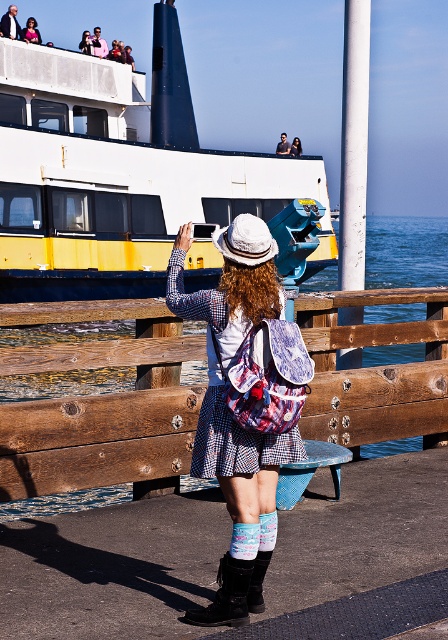
Question: Which is nearer to the leather boot at lower center?

Choices:
 (A) matte white hat at upper center
 (B) yellow painted metal ferry at upper left

Answer: (B)

Question: Which object is positioned closest to the matte black jacket at upper left?

Choices:
 (A) matte black jacket at upper center
 (B) leather boot at lower center
 (C) black leather boot at lower center

Answer: (A)

Question: Which object is the closest to the leather boot at lower center?

Choices:
 (A) pink fabric jacket at upper center
 (B) yellow painted metal ferry at upper left

Answer: (B)

Question: Observing the image, what is the correct spatial positioning of matte black jacket at upper center in reference to matte white hat at upper center?

Choices:
 (A) below
 (B) above

Answer: (B)

Question: Can you confirm if matte black jacket at upper left is positioned to the right of matte white hat at upper center?

Choices:
 (A) no
 (B) yes

Answer: (A)

Question: Is black leather boot at lower center smaller than matte white hat at upper center?

Choices:
 (A) yes
 (B) no

Answer: (A)